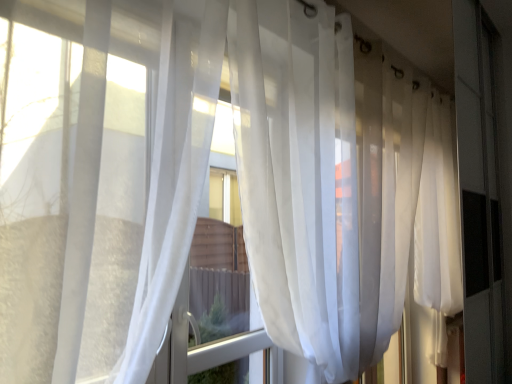
What do you see at coordinates (70, 182) in the screenshot? The image size is (512, 384). I see `translucent white curtain at left, the 1th curtain in the left-to-right sequence` at bounding box center [70, 182].

Locate an element on the screen. The image size is (512, 384). translucent white curtain at left, the second curtain from the right is located at coordinates click(70, 182).

Describe the element at coordinates (318, 183) in the screenshot. I see `translucent white curtain at center, arranged as the 2th curtain when viewed from the left` at that location.

I want to click on translucent white curtain at center, positioned as the first curtain in right-to-left order, so click(318, 183).

Locate an element on the screen. translucent white curtain at left, the 1th curtain in the left-to-right sequence is located at coordinates (70, 182).

Considering the relative positions of translucent white curtain at center, positioned as the first curtain in right-to-left order, and translucent white curtain at left, the 1th curtain in the left-to-right sequence, in the image provided, is translucent white curtain at center, positioned as the first curtain in right-to-left order, to the right of translucent white curtain at left, the 1th curtain in the left-to-right sequence, from the viewer's perspective?

Yes.

Looking at this image, in the image, is translucent white curtain at center, positioned as the first curtain in right-to-left order, positioned in front of or behind translucent white curtain at left, the second curtain from the right?

Clearly, translucent white curtain at center, positioned as the first curtain in right-to-left order, is behind translucent white curtain at left, the second curtain from the right.

Which is closer, (x=403, y=220) or (x=114, y=157)?

Point (x=403, y=220) is farther from the camera than point (x=114, y=157).

From the image's perspective, does translucent white curtain at center, arranged as the 2th curtain when viewed from the left, appear higher than translucent white curtain at left, the second curtain from the right?

No.

From a real-world perspective, is translucent white curtain at center, arranged as the 2th curtain when viewed from the left, located higher than translucent white curtain at left, the 1th curtain in the left-to-right sequence?

Actually, translucent white curtain at center, arranged as the 2th curtain when viewed from the left, is physically below translucent white curtain at left, the 1th curtain in the left-to-right sequence, in the real world.

Which object is wider, translucent white curtain at center, positioned as the first curtain in right-to-left order, or translucent white curtain at left, the second curtain from the right?

translucent white curtain at left, the second curtain from the right.

Considering the relative sizes of translucent white curtain at center, arranged as the 2th curtain when viewed from the left, and translucent white curtain at left, the second curtain from the right, in the image provided, is translucent white curtain at center, arranged as the 2th curtain when viewed from the left, taller than translucent white curtain at left, the second curtain from the right,?

Yes, translucent white curtain at center, arranged as the 2th curtain when viewed from the left, is taller than translucent white curtain at left, the second curtain from the right.

Does translucent white curtain at center, arranged as the 2th curtain when viewed from the left, have a smaller size compared to translucent white curtain at left, the 1th curtain in the left-to-right sequence?

No, translucent white curtain at center, arranged as the 2th curtain when viewed from the left, is not smaller than translucent white curtain at left, the 1th curtain in the left-to-right sequence.

Is translucent white curtain at center, arranged as the 2th curtain when viewed from the left, inside the boundaries of translucent white curtain at left, the second curtain from the right, or outside?

translucent white curtain at center, arranged as the 2th curtain when viewed from the left, is not inside translucent white curtain at left, the second curtain from the right, it's outside.

Is translucent white curtain at center, positioned as the first curtain in right-to-left order, positioned far away from translucent white curtain at left, the 1th curtain in the left-to-right sequence?

They are positioned close to each other.

Is translucent white curtain at center, positioned as the first curtain in right-to-left order, oriented towards translucent white curtain at left, the 1th curtain in the left-to-right sequence?

No, translucent white curtain at center, positioned as the first curtain in right-to-left order, is not turned towards translucent white curtain at left, the 1th curtain in the left-to-right sequence.

How different are the orientations of translucent white curtain at center, arranged as the 2th curtain when viewed from the left, and translucent white curtain at left, the 1th curtain in the left-to-right sequence, in degrees?

translucent white curtain at center, arranged as the 2th curtain when viewed from the left, and translucent white curtain at left, the 1th curtain in the left-to-right sequence, are facing 0.000182 degrees away from each other.

The width and height of the screenshot is (512, 384). Find the location of `curtain on the left of translucent white curtain at center, positioned as the first curtain in right-to-left order`. curtain on the left of translucent white curtain at center, positioned as the first curtain in right-to-left order is located at coordinates (70, 182).

Between translucent white curtain at left, the 1th curtain in the left-to-right sequence, and translucent white curtain at center, positioned as the first curtain in right-to-left order, which one appears on the right side from the viewer's perspective?

translucent white curtain at center, positioned as the first curtain in right-to-left order.

Is translucent white curtain at left, the 1th curtain in the left-to-right sequence, positioned behind translucent white curtain at center, positioned as the first curtain in right-to-left order?

No, translucent white curtain at left, the 1th curtain in the left-to-right sequence, is closer to the viewer.

Which is closer, (x=135, y=107) or (x=346, y=148)?

The point (x=135, y=107) is closer.

From the image's perspective, does translucent white curtain at left, the 1th curtain in the left-to-right sequence, appear lower than translucent white curtain at center, positioned as the first curtain in right-to-left order?

No, from the image's perspective, translucent white curtain at left, the 1th curtain in the left-to-right sequence, is not beneath translucent white curtain at center, positioned as the first curtain in right-to-left order.

From a real-world perspective, is translucent white curtain at left, the 1th curtain in the left-to-right sequence, located higher than translucent white curtain at center, positioned as the first curtain in right-to-left order?

Yes.

Looking at their sizes, would you say translucent white curtain at left, the second curtain from the right, is wider or thinner than translucent white curtain at center, arranged as the 2th curtain when viewed from the left?

Clearly, translucent white curtain at left, the second curtain from the right, has more width compared to translucent white curtain at center, arranged as the 2th curtain when viewed from the left.

In the scene shown: Can you confirm if translucent white curtain at left, the 1th curtain in the left-to-right sequence, is shorter than translucent white curtain at center, arranged as the 2th curtain when viewed from the left?

Yes.

Considering the relative sizes of translucent white curtain at left, the second curtain from the right, and translucent white curtain at center, arranged as the 2th curtain when viewed from the left, in the image provided, is translucent white curtain at left, the second curtain from the right, smaller than translucent white curtain at center, arranged as the 2th curtain when viewed from the left,?

Yes.

In the scene shown: Is translucent white curtain at left, the 1th curtain in the left-to-right sequence, located outside translucent white curtain at center, positioned as the first curtain in right-to-left order?

Yes, translucent white curtain at left, the 1th curtain in the left-to-right sequence, is located beyond the bounds of translucent white curtain at center, positioned as the first curtain in right-to-left order.

Is the surface of translucent white curtain at left, the 1th curtain in the left-to-right sequence, in direct contact with translucent white curtain at center, positioned as the first curtain in right-to-left order?

translucent white curtain at left, the 1th curtain in the left-to-right sequence, and translucent white curtain at center, positioned as the first curtain in right-to-left order, are clearly separated.

Based on the photo, could you tell me if translucent white curtain at left, the 1th curtain in the left-to-right sequence, is facing translucent white curtain at center, positioned as the first curtain in right-to-left order?

No, translucent white curtain at left, the 1th curtain in the left-to-right sequence, is not oriented towards translucent white curtain at center, positioned as the first curtain in right-to-left order.

Identify the location of curtain positioned vertically above the translucent white curtain at center, positioned as the first curtain in right-to-left order (from a real-world perspective). This screenshot has width=512, height=384. (70, 182).

At what (x,y) coordinates should I click in order to perform the action: click on curtain on the left side of translucent white curtain at center, positioned as the first curtain in right-to-left order. Please return your answer as a coordinate pair (x, y). Looking at the image, I should click on (70, 182).

The width and height of the screenshot is (512, 384). I want to click on curtain in front of the translucent white curtain at center, arranged as the 2th curtain when viewed from the left, so click(x=70, y=182).